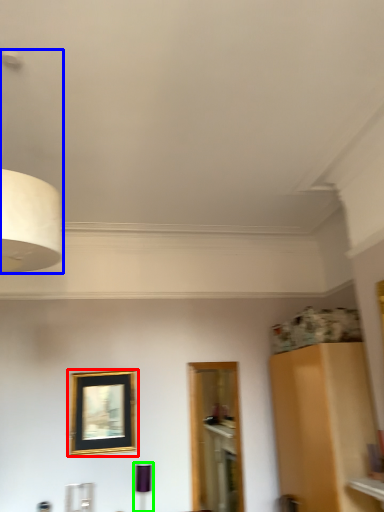
Question: Estimate the real-world distances between objects in this image. Which object is closer to picture frame (highlighted by a red box), lamp (highlighted by a blue box) or lamp (highlighted by a green box)?

Choices:
 (A) lamp
 (B) lamp

Answer: (B)